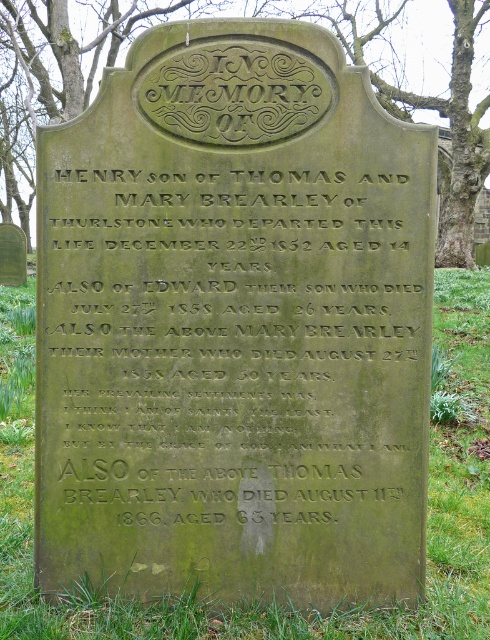
You are a historian examining the gravestone. You notice two green elements on the gravestone. The first is the green stone inscription at center, and the second is the green mossy stone at upper center. Which of these two elements takes up more space on the gravestone?

The green mossy stone at upper center takes up more space than the green stone inscription at center because the green stone inscription at center occupies less space than green mossy stone at upper center.

You are standing at the point marked at (137, 420). The gravestone is located at the origin point 0,0. Can you walk directly to the gravestone without crossing any obstacles?

The distance between the point marked at (137, 420) and the gravestone at 0,0 is 10.28 feet. Since the scene describes a cemetery with a weathered stone gravestone and no mention of obstacles like fences or other structures, you can walk directly to the gravestone without crossing any obstacles.